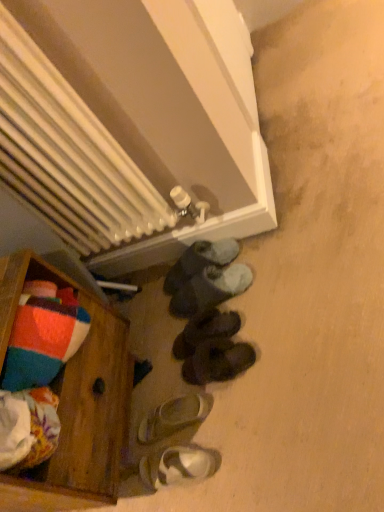
Locate an element on the screen. This screenshot has height=512, width=384. free spot in front of white matte sandals at lower center, arranged as the 1th footwear when ordered from the bottom is located at coordinates click(x=207, y=495).